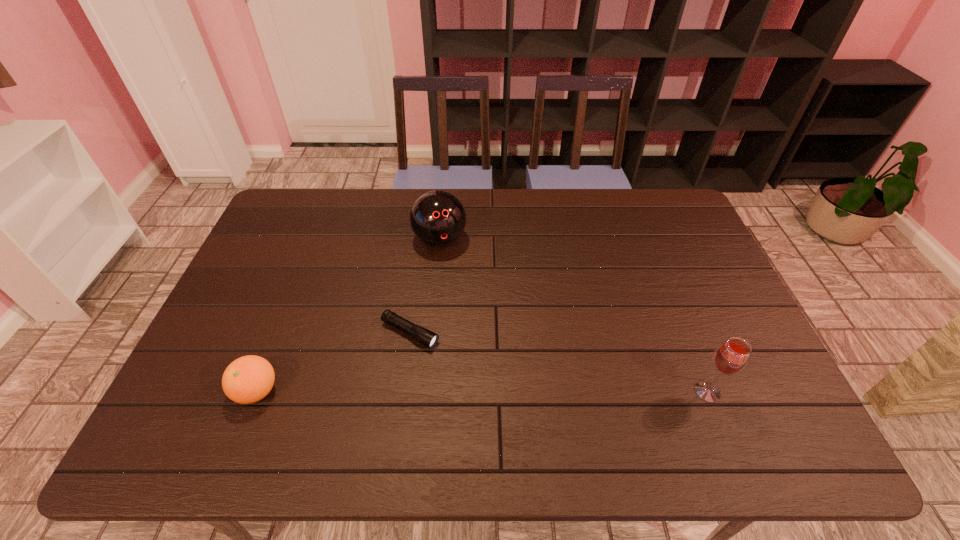
The image size is (960, 540). I want to click on object that is at the near right corner, so click(731, 357).

In order to click on vacant space at the far edge of the desktop in this screenshot , I will do `click(601, 192)`.

Where is `free space at the near edge of the desktop`? The image size is (960, 540). free space at the near edge of the desktop is located at coordinates tap(672, 379).

Where is `blank space at the left edge`? This screenshot has height=540, width=960. blank space at the left edge is located at coordinates (307, 237).

Locate an element on the screen. The height and width of the screenshot is (540, 960). free spot at the right edge of the desktop is located at coordinates (658, 245).

At what (x,y) coordinates should I click in order to perform the action: click on vacant space at the near left corner. Please return your answer as a coordinate pair (x, y). Looking at the image, I should click on coord(211,392).

I want to click on vacant area at the near right corner of the desktop, so click(724, 391).

The height and width of the screenshot is (540, 960). Identify the location of empty location between the farthest object and the leftmost object. (348, 315).

What are the coordinates of `blank region between the farthest object and the rightmost object` in the screenshot? It's located at (574, 316).

Where is `free space between the orange and the flashlight`? free space between the orange and the flashlight is located at coordinates (333, 362).